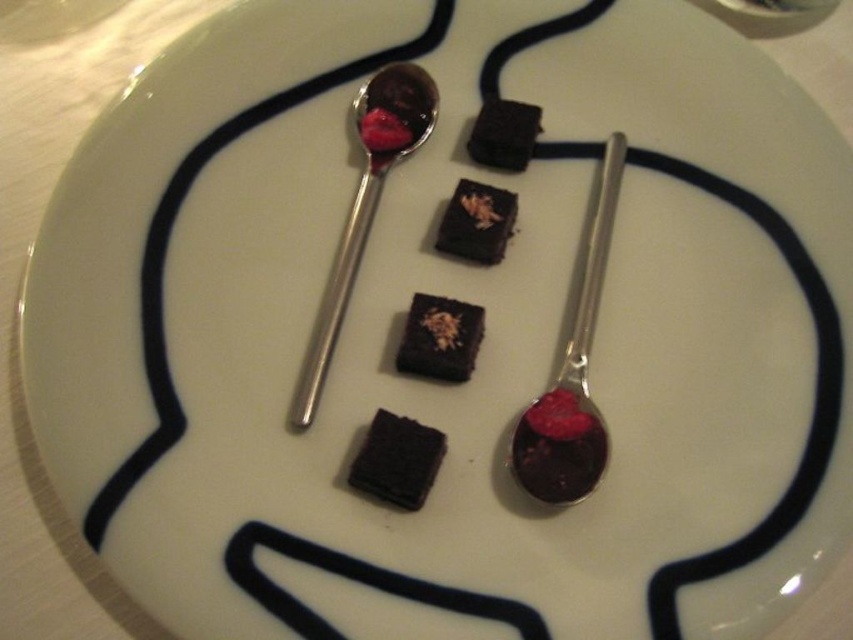
Is dark matte chocolate cake at center closer to camera compared to chocolate matte at center?

Yes.

Looking at this image, does dark matte chocolate cake at center have a larger size compared to chocolate matte at center?

Correct, dark matte chocolate cake at center is larger in size than chocolate matte at center.

Is point (402, 484) closer to camera compared to point (509, 218)?

That is True.

What are the coordinates of `dark matte chocolate cake at center` in the screenshot? It's located at (397, 460).

From the picture: Who is more forward, [619,186] or [422,456]?

Positioned in front is point [422,456].

You are a GUI agent. You are given a task and a screenshot of the screen. Output one action in this format:
    pyautogui.click(x=<x>, y=<y>)
    Task: Click on the shiny metal spoon at center right
    
    Given the screenshot: What is the action you would take?
    tap(572, 376)

Is point (570, 340) farther from viewer compared to point (397, 461)?

Yes, point (570, 340) is behind point (397, 461).

Identify the location of shiny metal spoon at center right. (x=572, y=376).

Measure the distance between chocolate matte at center and camera.

They are 4.31 feet apart.

Can you confirm if chocolate matte at center is positioned above dark matte chocolate cake at upper center?

Actually, chocolate matte at center is below dark matte chocolate cake at upper center.

Identify the location of chocolate matte at center. The image size is (853, 640). (476, 221).